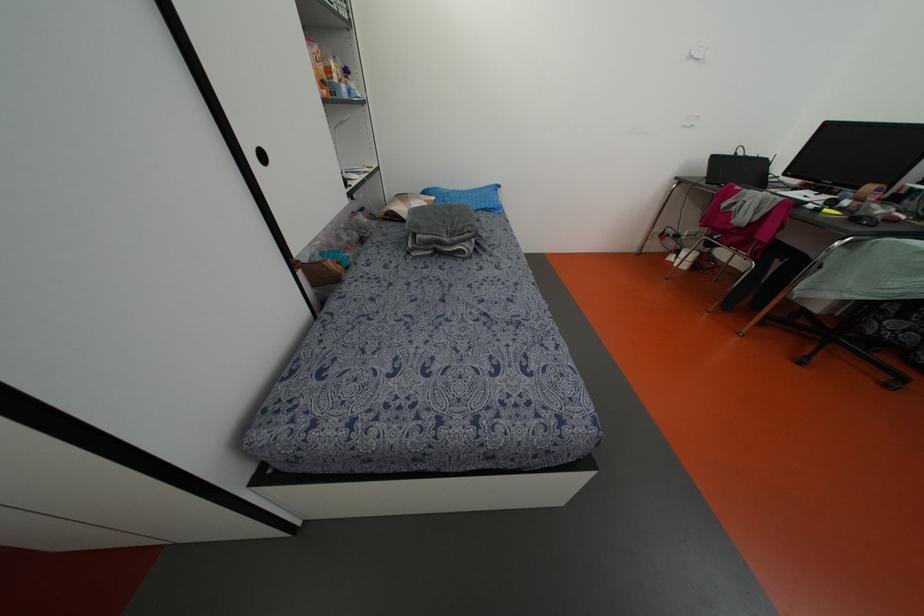
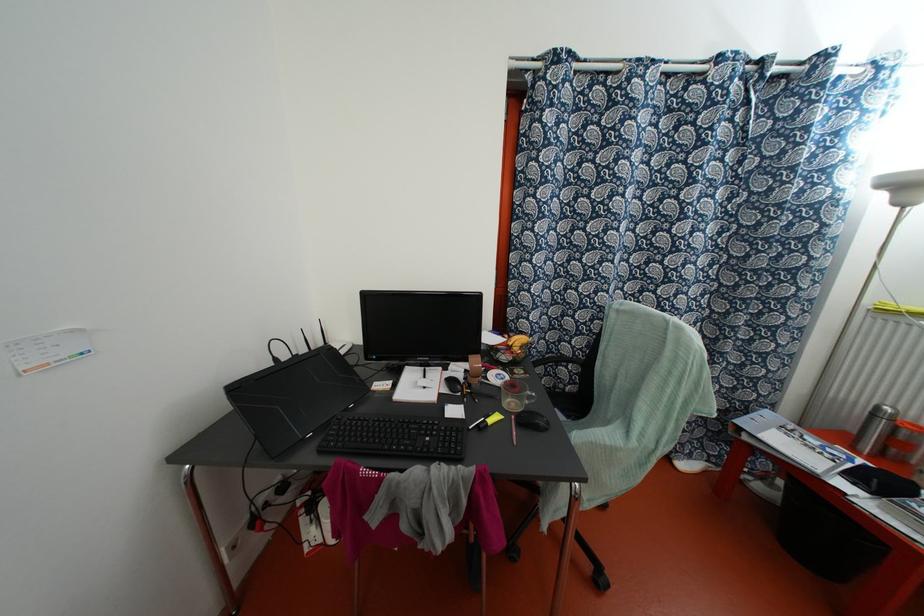
Locate, in the second image, the point that corresponds to point (825, 209) in the first image.

(489, 421)